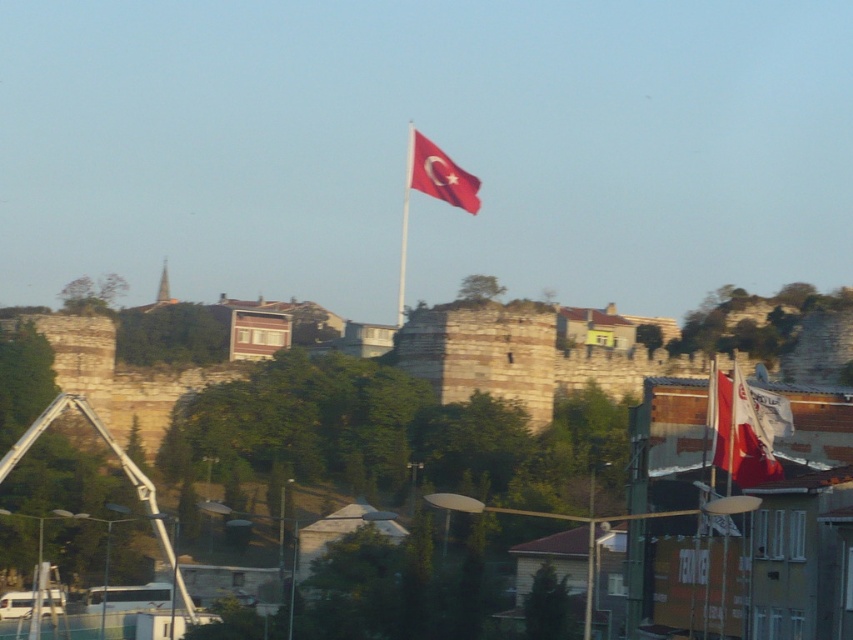
Question: Does red fabric flag at upper center have a greater width compared to red fabric flag pole at center?

Choices:
 (A) no
 (B) yes

Answer: (B)

Question: Which of the following is the farthest from the observer?

Choices:
 (A) red fabric flag at right
 (B) red fabric flag pole at center
 (C) red fabric flag at upper center

Answer: (C)

Question: Is red fabric flag at right thinner than red fabric flag at upper center?

Choices:
 (A) no
 (B) yes

Answer: (B)

Question: Is red fabric flag at right positioned in front of red fabric flag pole at center?

Choices:
 (A) no
 (B) yes

Answer: (B)

Question: Which object is the farthest from the red fabric flag at upper center?

Choices:
 (A) red fabric flag pole at center
 (B) red fabric flag at right

Answer: (B)

Question: Considering the real-world distances, which object is closest to the red fabric flag at right?

Choices:
 (A) red fabric flag pole at center
 (B) red fabric flag at upper center

Answer: (A)